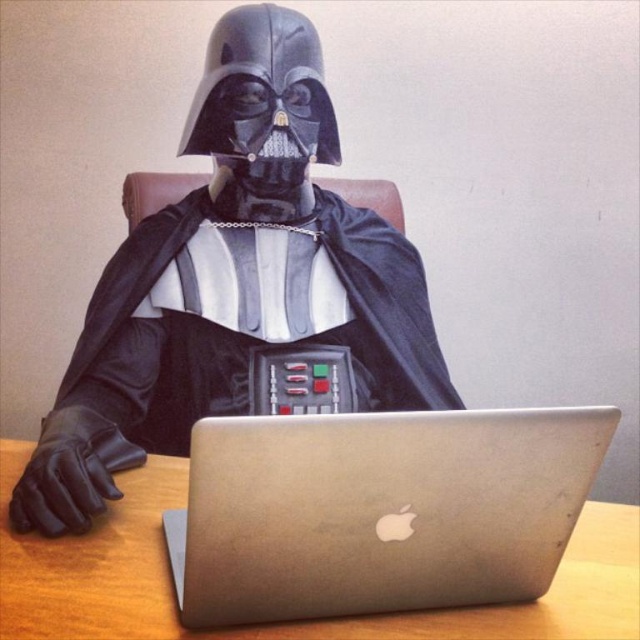
Question: Which point is closer to the camera taking this photo?

Choices:
 (A) (244, 132)
 (B) (268, 570)
 (C) (122, 250)

Answer: (B)

Question: Is the position of silver metallic laptop at center less distant than that of black matte robe at center?

Choices:
 (A) yes
 (B) no

Answer: (A)

Question: Can you confirm if metallic silver laptop at center is smaller than silver metallic laptop at center?

Choices:
 (A) no
 (B) yes

Answer: (A)

Question: Which point is farther to the camera?

Choices:
 (A) silver metallic laptop at center
 (B) black matte robe at center

Answer: (B)

Question: Estimate the real-world distances between objects in this image. Which object is farther from the silver metallic laptop at center?

Choices:
 (A) metallic silver laptop at center
 (B) black matte robe at center

Answer: (B)

Question: Where is silver metallic laptop at center located in relation to black matte robe at center in the image?

Choices:
 (A) above
 (B) below

Answer: (B)